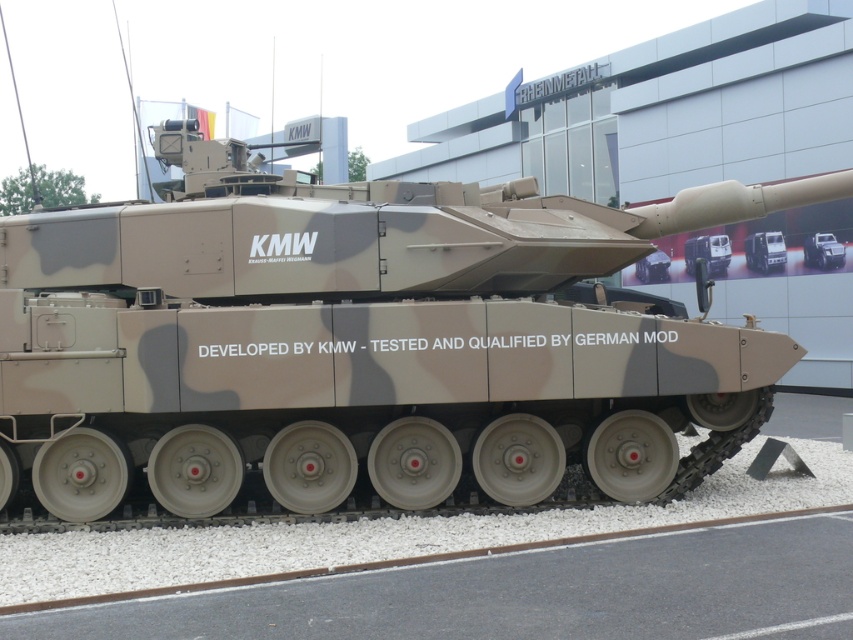
Does camouflage matte tank at center have a greater height compared to camouflage textured tank at center?

Correct, camouflage matte tank at center is much taller as camouflage textured tank at center.

Is point (764, 264) farther from viewer compared to point (830, 248)?

That is True.

The image size is (853, 640). What are the coordinates of `camouflage matte tank at center` in the screenshot? It's located at (764, 252).